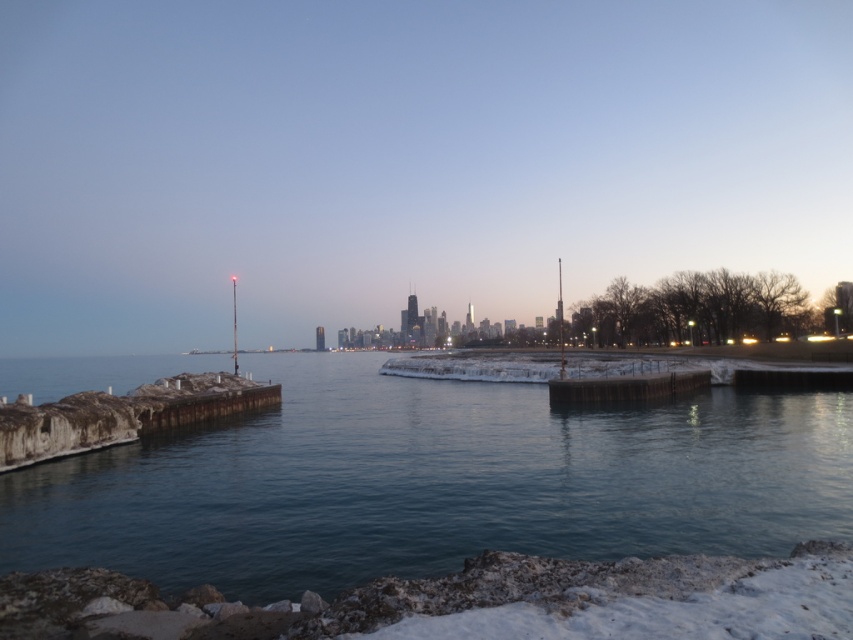
You are a photographer aiming to capture the waterfront scene. You want to focus on the rusty wood dock at lower left and the wooden dock at center. Which dock should you choose to frame in your shot if you want to emphasize its size relative to the other?

The rusty wood dock at lower left has a larger size compared to wooden dock at center, so you should frame the rusty wood dock at lower left to emphasize its larger size.

You are standing on the wooden dock at center and want to reach the smooth concrete piers at lower left. Based on the scene description, can you determine if you need to go upwards or downwards to reach them?

The smooth concrete piers at lower left are below the wooden dock at center, so you would need to go downwards to reach them.